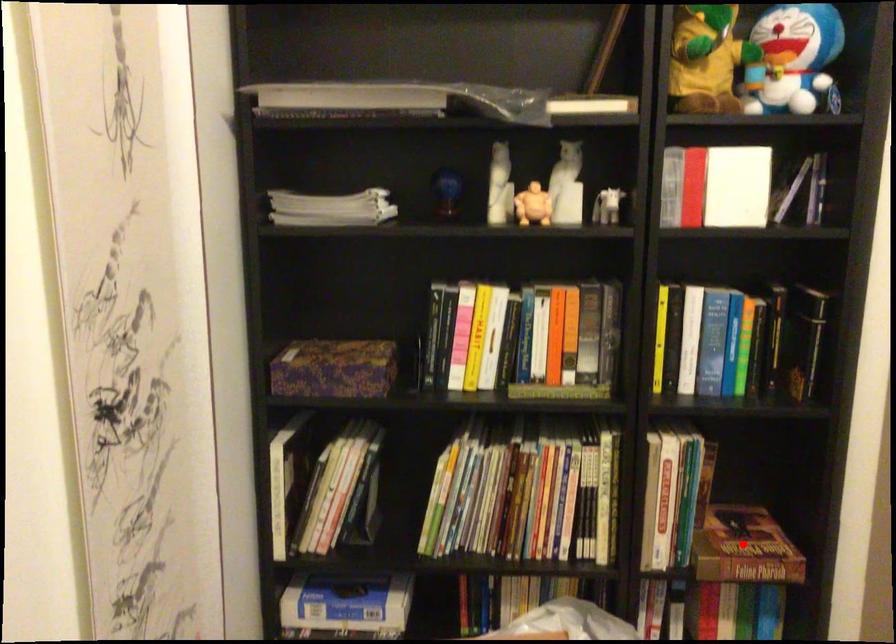
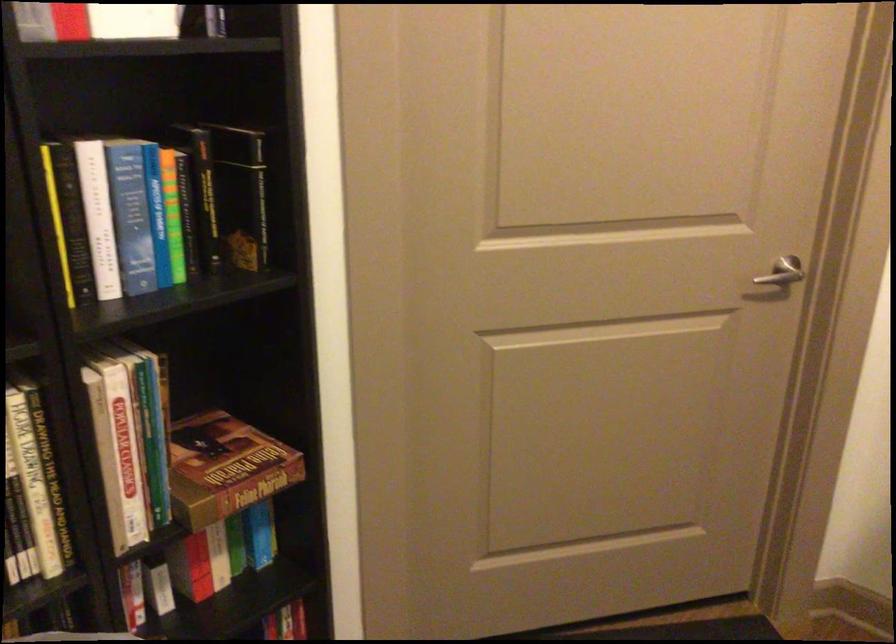
Question: I am providing you with two images of the same scene from different viewpoints. Image1 has a red point marked. In image2, the corresponding 3D location appears at what relative position? Reply with the corresponding letter.

Choices:
 (A) Closer
 (B) Farther

Answer: (A)